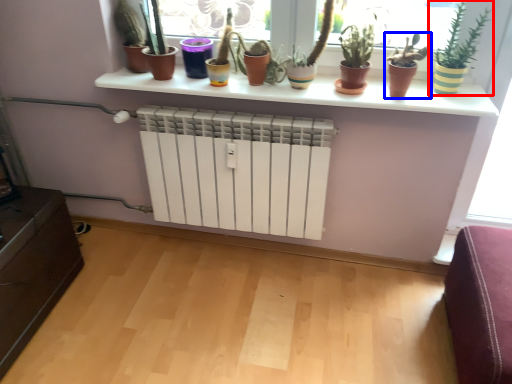
Question: Which object appears closest to the camera in this image, houseplant (highlighted by a red box) or houseplant (highlighted by a blue box)?

Choices:
 (A) houseplant
 (B) houseplant

Answer: (A)